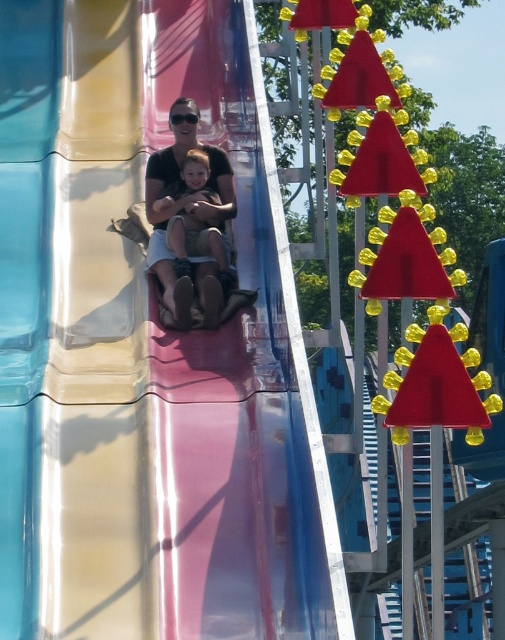
You are a photographer trying to capture the perfect shot of the matte black shirt at center and the matte brown shorts at center. Based on their positions, which object should you focus on first if you want to start with the one closer to the camera?

The matte black shirt at center is to the left of the matte brown shorts at center, so focusing on the matte black shirt at center first would be appropriate as it is closer to the camera.

You are standing in front of the water slide and see the matte black shirt at center and the matte brown shorts at center. Which item is positioned closer to you?

The matte black shirt at center is closer to the viewer than the matte brown shorts at center.

What are the coordinates of the translucent plastic slide at center?

The translucent plastic slide at center is located at point (148, 348).